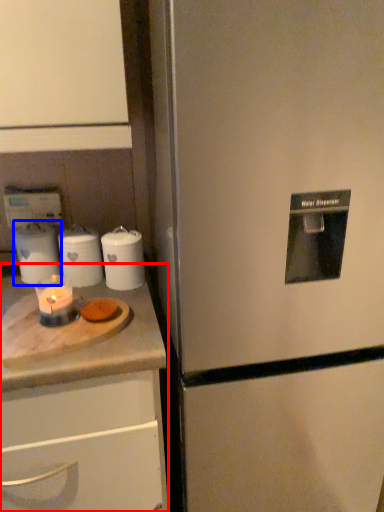
Question: Which object appears farthest to the camera in this image, counter (highlighted by a red box) or appliance (highlighted by a blue box)?

Choices:
 (A) counter
 (B) appliance

Answer: (B)